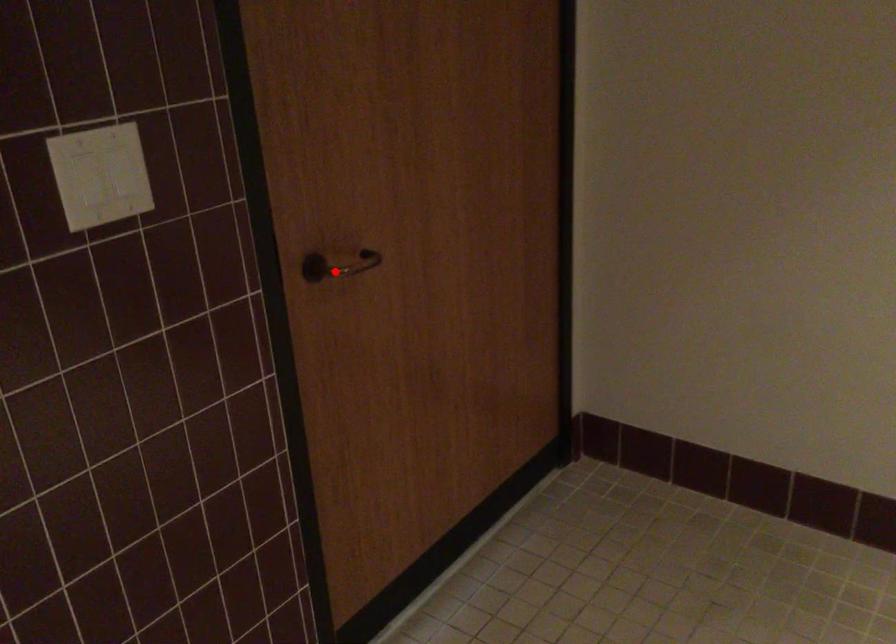
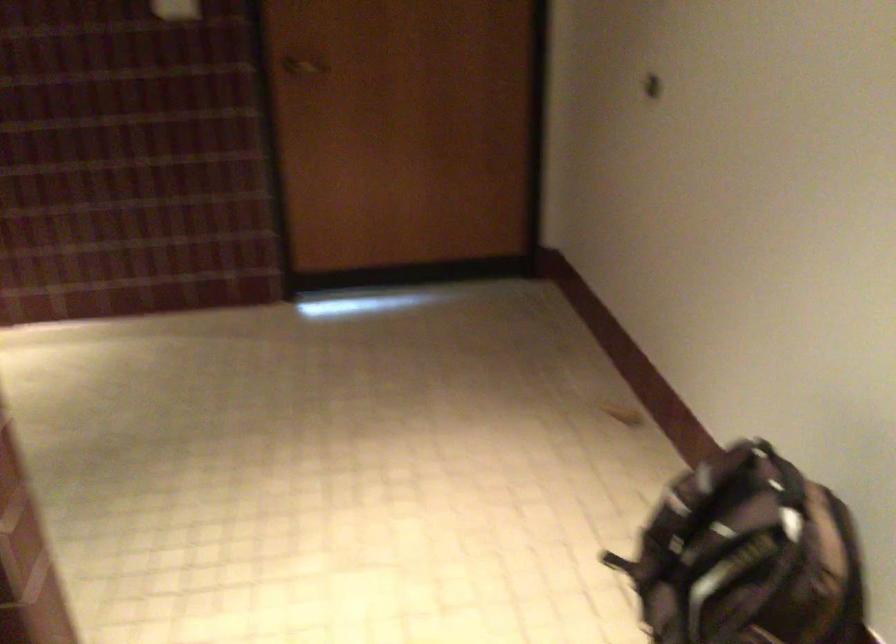
The point at the highlighted location is marked in the first image. Where is the corresponding point in the second image?

(304, 66)